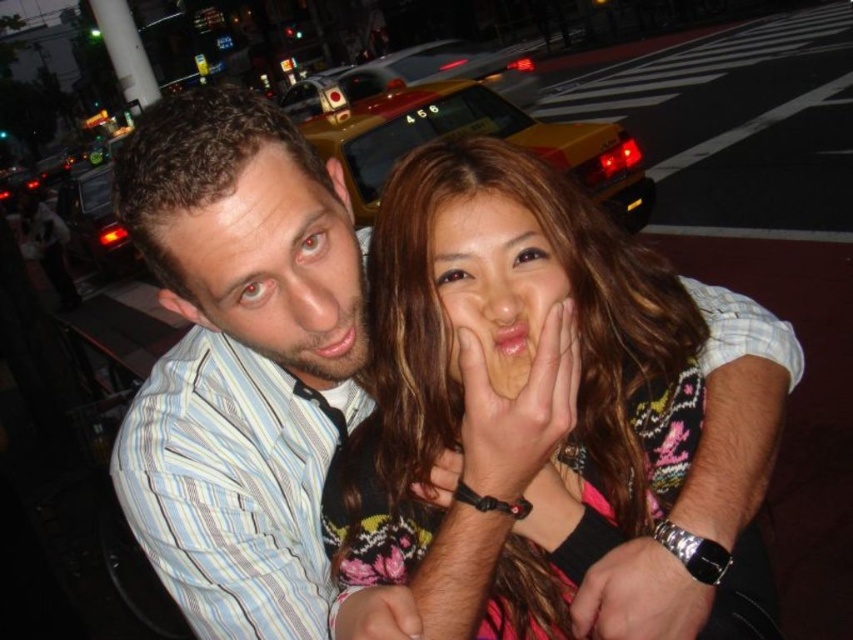
Question: Among these points, which one is nearest to the camera?

Choices:
 (A) (529, 330)
 (B) (587, 147)
 (C) (280, 348)

Answer: (A)

Question: Does striped shirt at center lie behind matte skin face at center?

Choices:
 (A) no
 (B) yes

Answer: (B)

Question: Can you confirm if multicolored floral dress at center is positioned to the right of matte skin face at center?

Choices:
 (A) no
 (B) yes

Answer: (B)

Question: Does multicolored floral dress at center lie behind matte skin face at center?

Choices:
 (A) no
 (B) yes

Answer: (B)

Question: Which of the following is the closest to the observer?

Choices:
 (A) multicolored floral dress at center
 (B) matte skin face at center

Answer: (B)

Question: Which point appears closest to the camera in this image?

Choices:
 (A) (694, 396)
 (B) (456, 342)

Answer: (B)